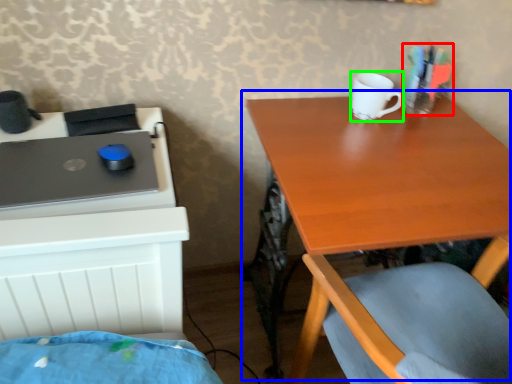
Question: Estimate the real-world distances between objects in this image. Which object is closer to stationery (highlighted by a red box), table (highlighted by a blue box) or mug (highlighted by a green box)?

Choices:
 (A) table
 (B) mug

Answer: (B)